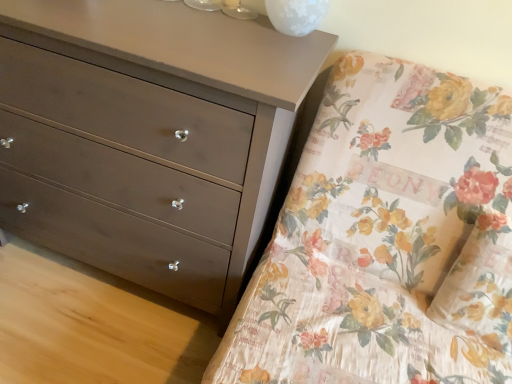
Identify the location of vacant space in front of white frosted glass at upper center. The width and height of the screenshot is (512, 384). (276, 46).